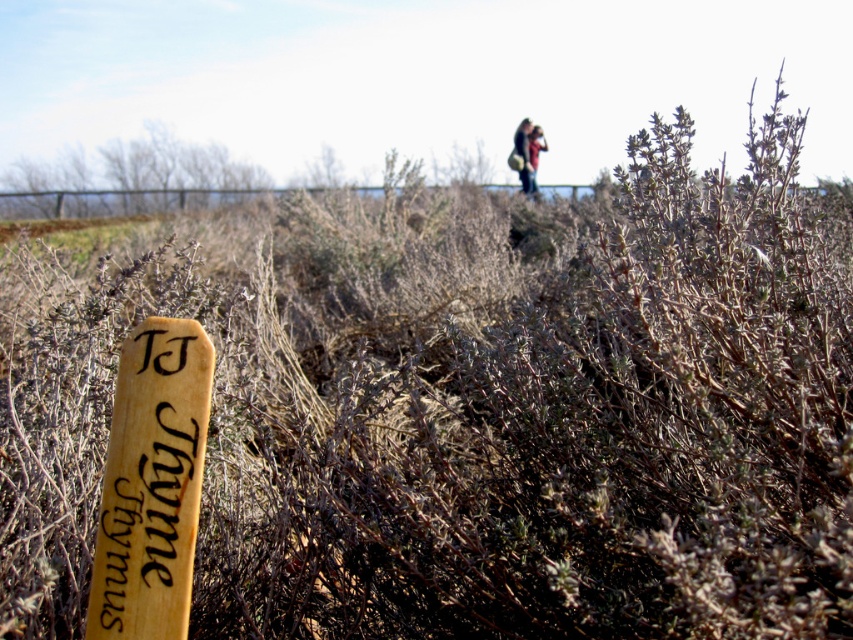
Question: Which object appears closest to the camera in this image?

Choices:
 (A) brown leather jacket at upper center
 (B) dark brown leather jacket at upper center

Answer: (B)

Question: Which point is closer to the camera?

Choices:
 (A) (521, 157)
 (B) (532, 131)

Answer: (A)

Question: Is dark brown leather jacket at upper center positioned behind brown leather jacket at upper center?

Choices:
 (A) no
 (B) yes

Answer: (A)

Question: Is dark brown leather jacket at upper center to the left of brown leather jacket at upper center from the viewer's perspective?

Choices:
 (A) yes
 (B) no

Answer: (A)

Question: Can you confirm if dark brown leather jacket at upper center is bigger than brown leather jacket at upper center?

Choices:
 (A) no
 (B) yes

Answer: (A)